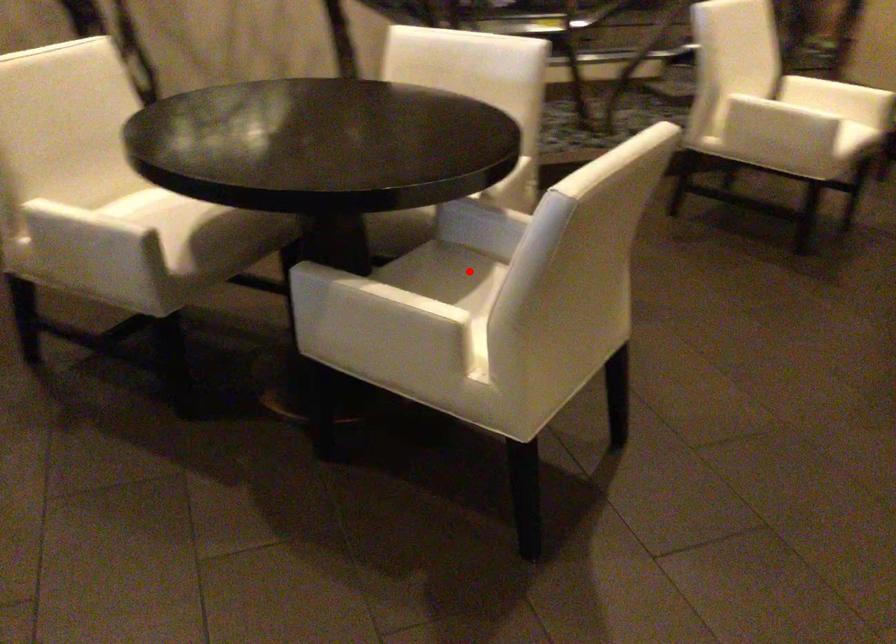
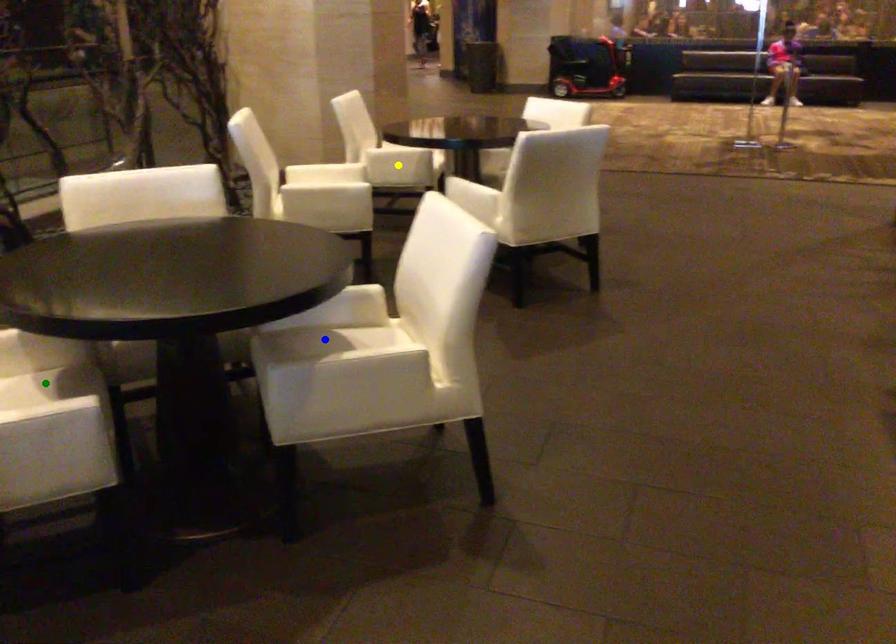
Question: I am providing you with two images of the same scene from different viewpoints. A red point is marked on the first image. You are given multiple points on the second image. Which point in image 2 is actually the same real-world point as the red point in image 1?

Choices:
 (A) blue point
 (B) green point
 (C) yellow point

Answer: (A)